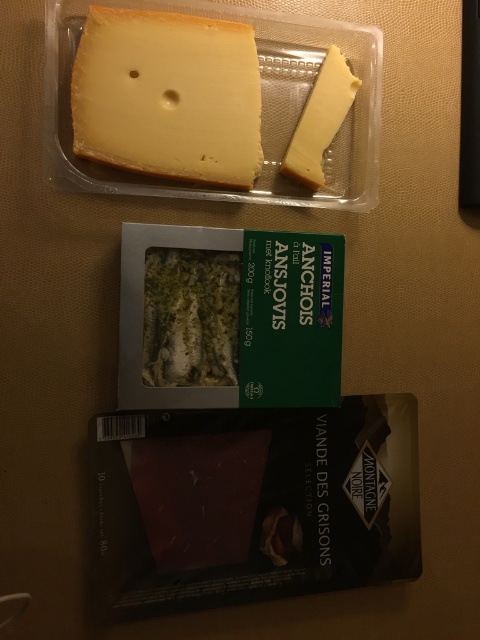
Does greenish-white flaky at center appear on the right side of yellow cheese at upper right?

Incorrect, greenish-white flaky at center is not on the right side of yellow cheese at upper right.

Does point (146, 358) come in front of point (340, 68)?

Yes, point (146, 358) is closer to viewer.

What do you see at coordinates (191, 317) in the screenshot? I see `greenish-white flaky at center` at bounding box center [191, 317].

This screenshot has height=640, width=480. Find the location of `greenish-white flaky at center`. greenish-white flaky at center is located at coordinates (191, 317).

Does point (79, 122) lie behind point (239, 296)?

No, it is not.

Which is behind, point (167, 17) or point (147, 365)?

Point (147, 365)

Locate an element on the screen. yellowish matte cheese at upper left is located at coordinates (168, 96).

From the picture: Does yellowish matte cheese at upper left have a greater height compared to yellow cheese at upper right?

Correct, yellowish matte cheese at upper left is much taller as yellow cheese at upper right.

Measure the distance from yellowish matte cheese at upper left to yellow cheese at upper right.

yellowish matte cheese at upper left and yellow cheese at upper right are 5.79 inches apart.

Is point (204, 68) positioned before point (283, 170)?

Yes, point (204, 68) is in front of point (283, 170).

Image resolution: width=480 pixels, height=640 pixels. Identify the location of yellowish matte cheese at upper left. (168, 96).